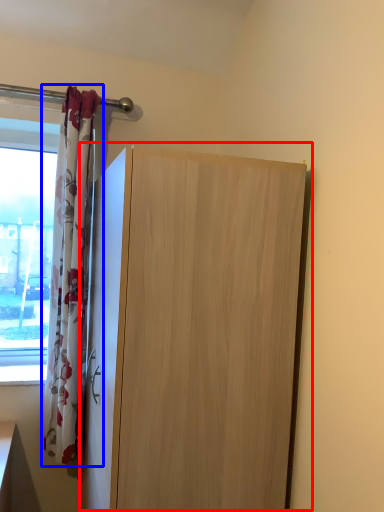
Question: Which object is further to the camera taking this photo, cupboard (highlighted by a red box) or curtain (highlighted by a blue box)?

Choices:
 (A) cupboard
 (B) curtain

Answer: (B)